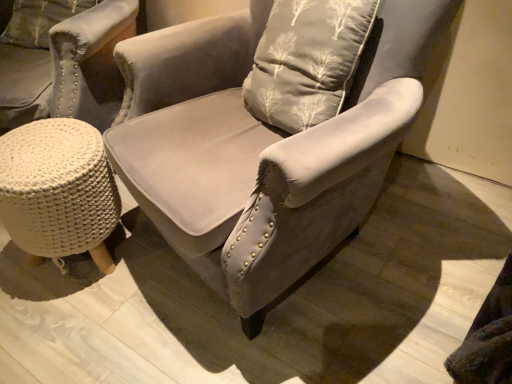
At what (x,y) coordinates should I click in order to perform the action: click on velvet gray pillow with tree pattern at upper left. Please return your answer as a coordinate pair (x, y). The height and width of the screenshot is (384, 512). Looking at the image, I should click on (39, 20).

Find the location of a particular element. white knitted stool at lower left is located at coordinates (58, 191).

This screenshot has height=384, width=512. I want to click on velvet gray pillow with tree pattern at upper left, so click(x=39, y=20).

Is point (392, 111) positioned behind point (33, 2)?

That is False.

Is suede gray armchair at center next to velvet gray pillow with tree pattern at upper left and touching it?

No, suede gray armchair at center is not making contact with velvet gray pillow with tree pattern at upper left.

Find the location of `pillow on the left side of suede gray armchair at center`. pillow on the left side of suede gray armchair at center is located at coordinates (39, 20).

Is suede gray armchair at center positioned with its back to velvet gray pillow with tree pattern at upper left?

No.

From the image's perspective, which is below, white knitted stool at lower left or velvet gray pillow with tree pattern at upper left?

white knitted stool at lower left appears lower in the image.

Is white knitted stool at lower left aimed at velvet gray pillow with tree pattern at upper left?

No, white knitted stool at lower left does not turn towards velvet gray pillow with tree pattern at upper left.

Is white knitted stool at lower left taller or shorter than velvet gray pillow with tree pattern at upper left?

white knitted stool at lower left is taller than velvet gray pillow with tree pattern at upper left.

Would you say white knitted stool at lower left is outside velvet gray pillow with tree pattern at upper left?

white knitted stool at lower left is positioned outside velvet gray pillow with tree pattern at upper left.

Considering the relative positions of velvet gray pillow with tree pattern at upper left and white knitted stool at lower left in the image provided, is velvet gray pillow with tree pattern at upper left behind white knitted stool at lower left?

Yes, velvet gray pillow with tree pattern at upper left is further from the viewer.

From a real-world perspective, who is located higher, velvet gray pillow with tree pattern at upper left or white knitted stool at lower left?

velvet gray pillow with tree pattern at upper left, from a real-world perspective.

You are a GUI agent. You are given a task and a screenshot of the screen. Output one action in this format:
    pyautogui.click(x=<x>, y=<y>)
    Task: Click on the pillow behind the white knitted stool at lower left
    Image resolution: width=512 pixels, height=384 pixels.
    Given the screenshot: What is the action you would take?
    pyautogui.click(x=39, y=20)

Between suede gray armchair at center and white knitted stool at lower left, which one is positioned behind?

white knitted stool at lower left.

Which of these two, suede gray armchair at center or white knitted stool at lower left, stands taller?

suede gray armchair at center is taller.

What's the angular difference between suede gray armchair at center and white knitted stool at lower left's facing directions?

The angular difference between suede gray armchair at center and white knitted stool at lower left is 14.9 degrees.

From the image's perspective, is suede gray armchair at center above white knitted stool at lower left?

Yes, from the image's perspective, suede gray armchair at center is above white knitted stool at lower left.

Could you tell me if white knitted stool at lower left is facing suede gray armchair at center?

No, white knitted stool at lower left is not turned towards suede gray armchair at center.

Would you say white knitted stool at lower left contains suede gray armchair at center?

Actually, suede gray armchair at center is outside white knitted stool at lower left.

From a real-world perspective, between white knitted stool at lower left and suede gray armchair at center, who is vertically lower?

In real-world perspective, white knitted stool at lower left is lower.

Which is less distant, [89,211] or [142,142]?

Point [89,211] is positioned farther from the camera compared to point [142,142].

From the image's perspective, is velvet gray pillow with tree pattern at upper left on top of suede gray armchair at center?

Yes, from the image's perspective, velvet gray pillow with tree pattern at upper left is on top of suede gray armchair at center.

Do you think velvet gray pillow with tree pattern at upper left is within suede gray armchair at center, or outside of it?

velvet gray pillow with tree pattern at upper left is not inside suede gray armchair at center, it's outside.

In terms of height, does velvet gray pillow with tree pattern at upper left look taller or shorter compared to suede gray armchair at center?

Considering their sizes, velvet gray pillow with tree pattern at upper left has less height than suede gray armchair at center.

In the scene shown: From a real-world perspective, does velvet gray pillow with tree pattern at upper left sit lower than suede gray armchair at center?

No, from a real-world perspective, velvet gray pillow with tree pattern at upper left is not under suede gray armchair at center.

Where is `pillow above the suede gray armchair at center (from a real-world perspective)`? This screenshot has width=512, height=384. pillow above the suede gray armchair at center (from a real-world perspective) is located at coordinates (39, 20).

Locate an element on the screen. music stool below the velvet gray pillow with tree pattern at upper left (from the image's perspective) is located at coordinates (58, 191).

Considering their positions, is white knitted stool at lower left positioned closer to velvet gray pillow with tree pattern at upper left than suede gray armchair at center?

white knitted stool at lower left.

Which object lies further to the anchor point white knitted stool at lower left, velvet gray pillow with tree pattern at upper left or suede gray armchair at center?

velvet gray pillow with tree pattern at upper left is further to white knitted stool at lower left.

Based on their spatial positions, is white knitted stool at lower left or velvet gray pillow with tree pattern at upper left further from suede gray armchair at center?

velvet gray pillow with tree pattern at upper left is positioned further to the anchor suede gray armchair at center.

Based on their spatial positions, is suede gray armchair at center or white knitted stool at lower left further from velvet gray pillow with tree pattern at upper left?

Based on the image, suede gray armchair at center appears to be further to velvet gray pillow with tree pattern at upper left.

When comparing their distances from suede gray armchair at center, does velvet gray pillow with tree pattern at upper left or white knitted stool at lower left seem closer?

white knitted stool at lower left lies closer to suede gray armchair at center than the other object.

When comparing their distances from white knitted stool at lower left, does suede gray armchair at center or velvet gray pillow with tree pattern at upper left seem closer?

suede gray armchair at center is closer to white knitted stool at lower left.

Locate an element on the screen. The width and height of the screenshot is (512, 384). music stool between suede gray armchair at center and velvet gray pillow with tree pattern at upper left in the front-back direction is located at coordinates (58, 191).